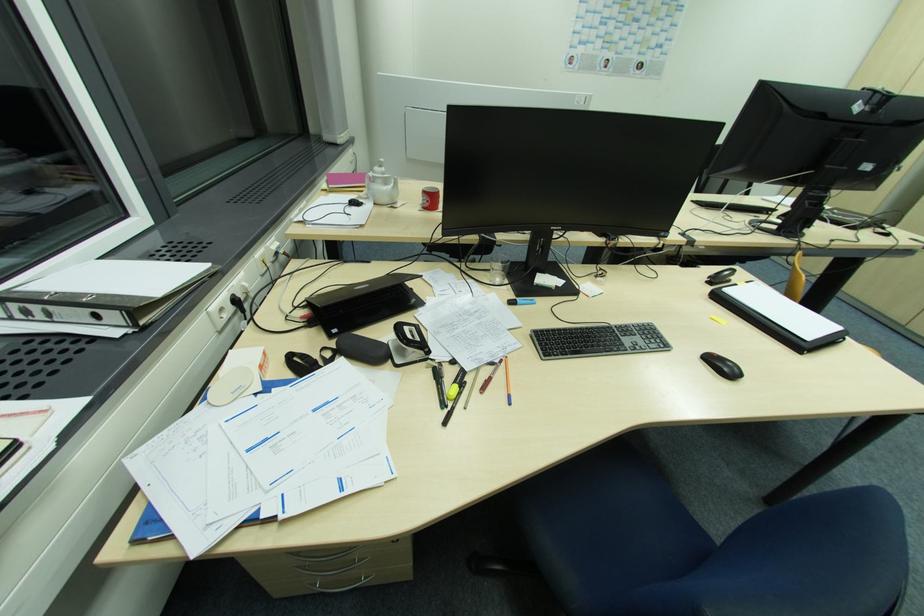
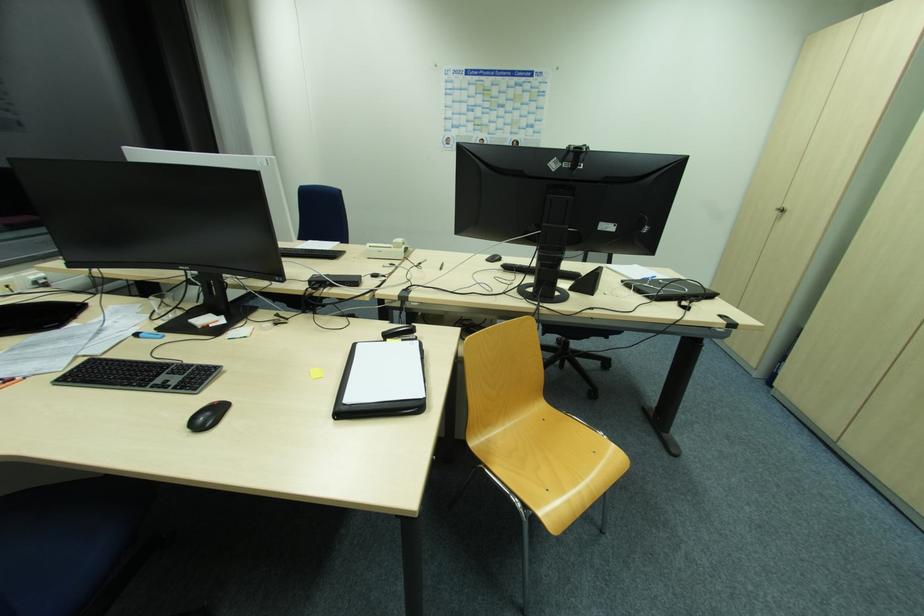
The point at (861,102) is marked in the first image. Where is the corresponding point in the second image?

(557, 159)